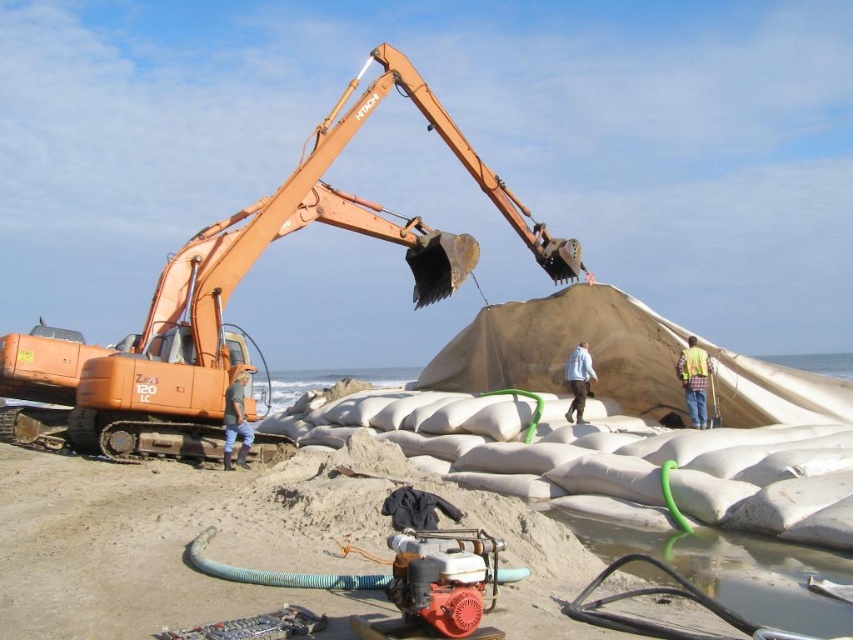
You are a construction worker who needs to move the green hose from the sandbags to the excavator. Based on the scene, which direction should you move the hose from the beige sandbags at center to the orange metallic excavator at left?

The beige sandbags at center is to the left of orange metallic excavator at left, so you should move the green hose to the right to reach the excavator.

You are a construction worker on the beach. You need to move the green hose from its current position over the beige sandbags at center to the orange metallic excavator at left. Can you walk directly between them without stepping into water?

The beige sandbags at center are in front of the orange metallic excavator at left, meaning the excavator is behind the sandbags from your viewpoint. To reach the excavator, you would have to go around the sandbags, possibly stepping into water depending on the path. The question cannot be answered definitively without more details about the water location.

You are a safety inspector checking the equipment on the beach. You notice the yellow reflective vest at center and the green rubber boots at lower center. Which piece of safety gear has a greater width?

The yellow reflective vest at center has a greater width than the green rubber boots at lower center.